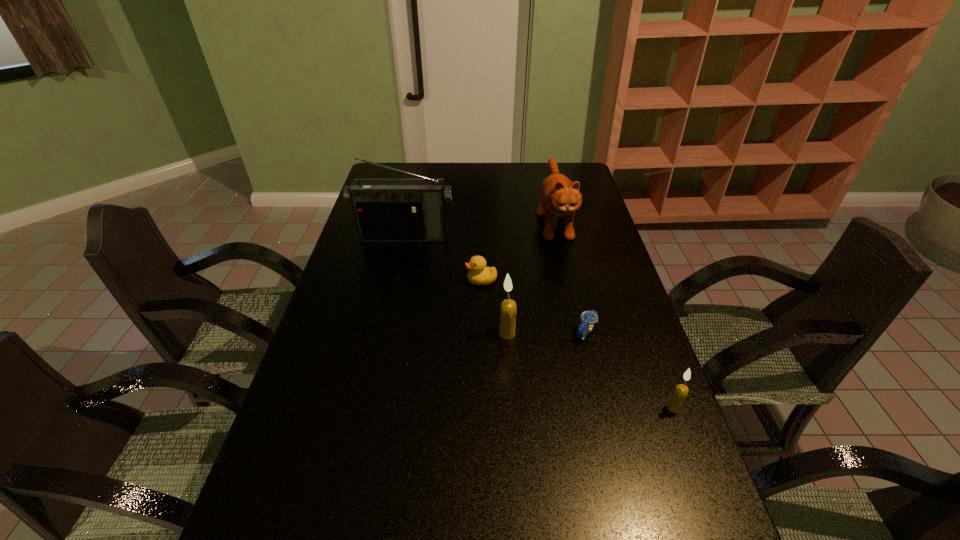
I want to click on the taller candle, so click(508, 310).

Where is `the left candle`? The image size is (960, 540). the left candle is located at coordinates (508, 310).

What are the coordinates of `the right candle` in the screenshot? It's located at (x=676, y=401).

In order to click on the shorter candle in this screenshot , I will do `click(676, 401)`.

Image resolution: width=960 pixels, height=540 pixels. In order to click on cat in this screenshot , I will do `click(559, 196)`.

Find the location of a particular element. radio receiver is located at coordinates (386, 210).

I want to click on the tallest object, so click(386, 210).

The height and width of the screenshot is (540, 960). Identify the location of the fifth tallest object. (479, 274).

Find the location of a particular element. This screenshot has width=960, height=540. the fourth nearest object is located at coordinates (479, 274).

The width and height of the screenshot is (960, 540). Find the location of `the shortest object`. the shortest object is located at coordinates (588, 318).